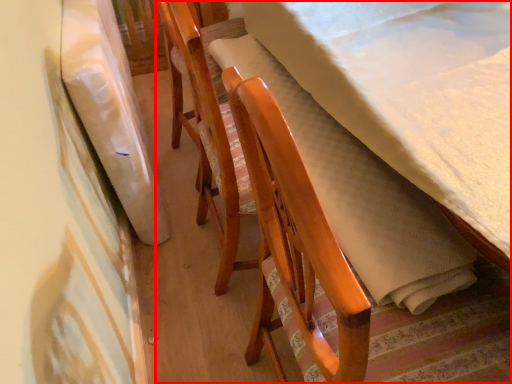
Question: From the image's perspective, considering the relative positions of furniture (annotated by the red box) and blanket in the image provided, where is furniture (annotated by the red box) located with respect to the staircase?

Choices:
 (A) above
 (B) below

Answer: (B)